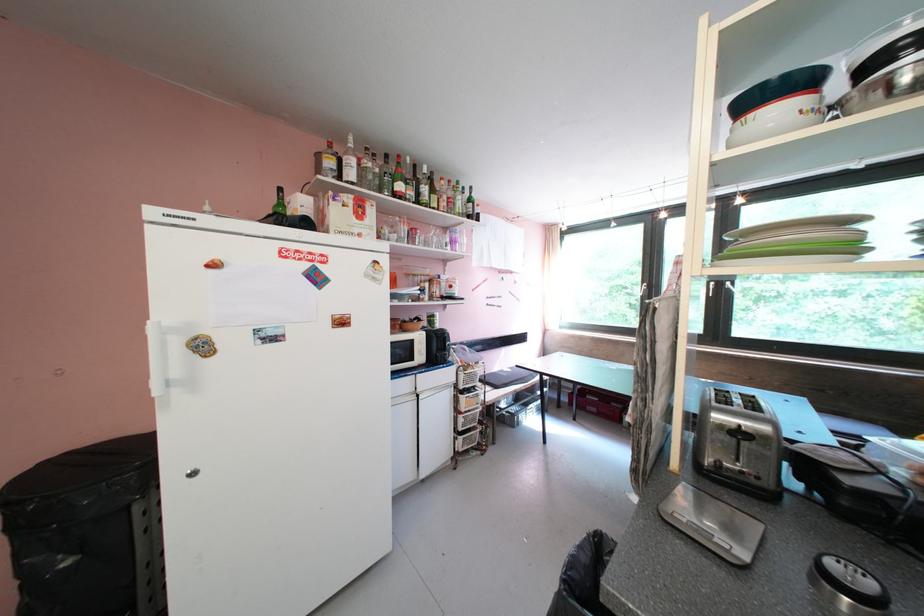
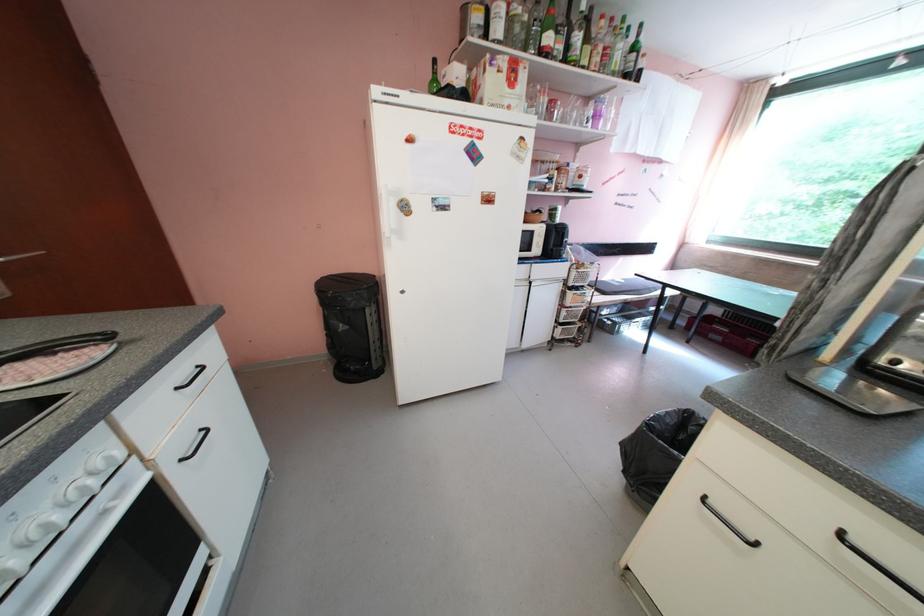
Where in the second image is the point corresponding to (473,369) from the first image?

(588, 268)